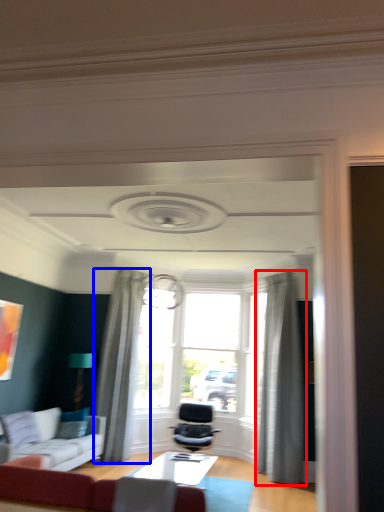
Question: Which of the following is the farthest to the observer, curtain (highlighted by a red box) or curtain (highlighted by a blue box)?

Choices:
 (A) curtain
 (B) curtain

Answer: (B)